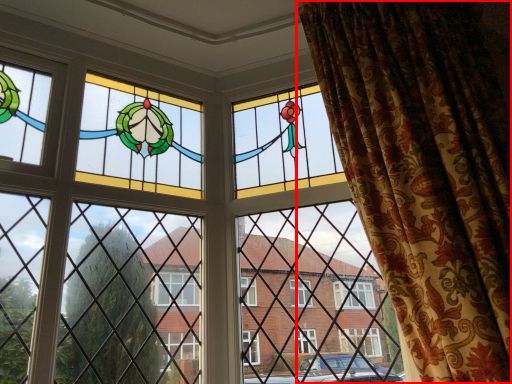
Question: From the image's perspective, considering the relative positions of curtain (annotated by the red box) and window in the image provided, where is curtain (annotated by the red box) located with respect to the staircase?

Choices:
 (A) below
 (B) above

Answer: (B)